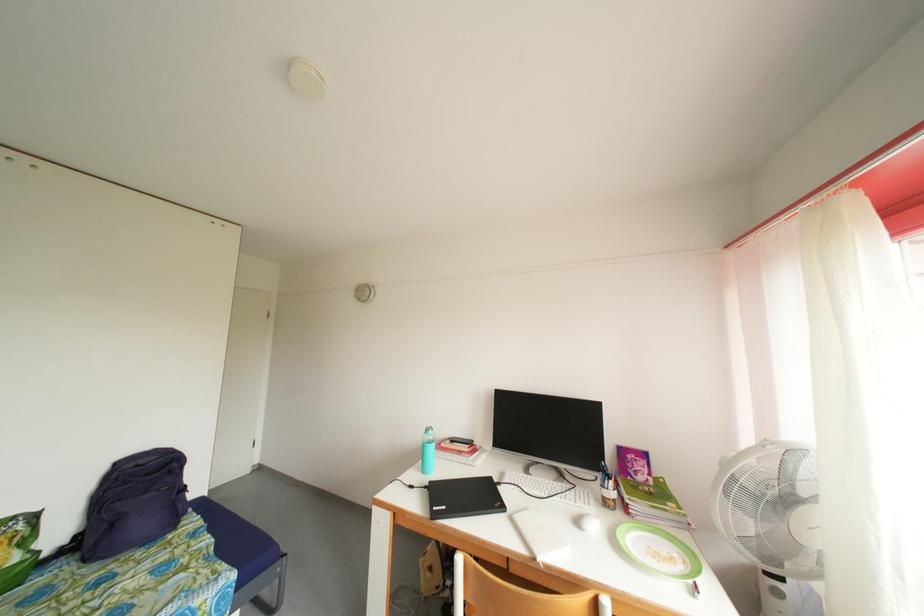
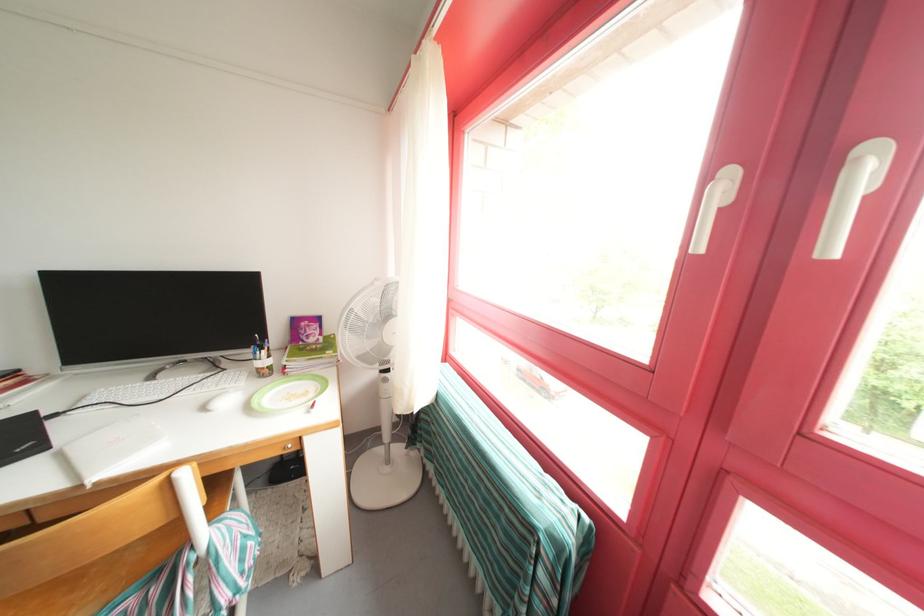
The images are taken continuously from a first-person perspective. In which direction is your viewpoint rotating?

The camera rotated toward right-down.